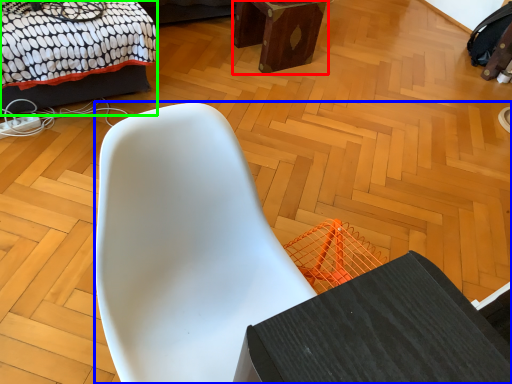
Question: Estimate the real-world distances between objects in this image. Which object is closer to furniture (highlighted by a red box), chair (highlighted by a blue box) or bed (highlighted by a green box)?

Choices:
 (A) chair
 (B) bed

Answer: (B)